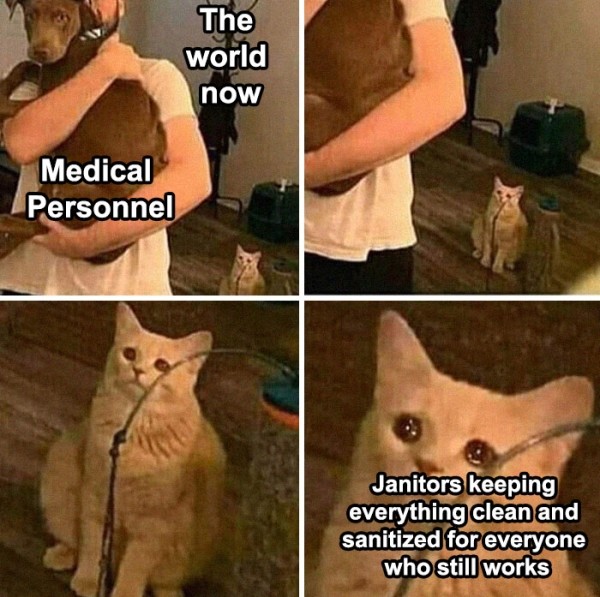
What are the coordinates of `beige wall on top left and top right photo` in the screenshot? It's located at (156, 32), (559, 48).